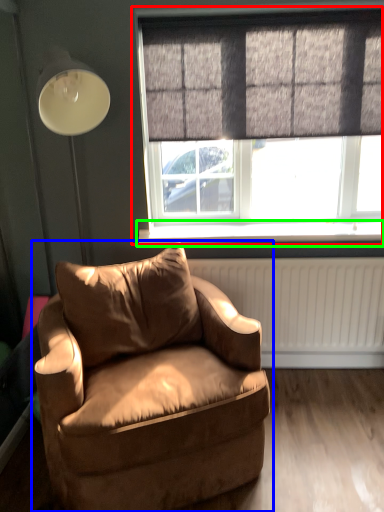
Question: Estimate the real-world distances between objects in this image. Which object is closer to window (highlighted by a red box), chair (highlighted by a blue box) or window sill (highlighted by a green box)?

Choices:
 (A) chair
 (B) window sill

Answer: (B)